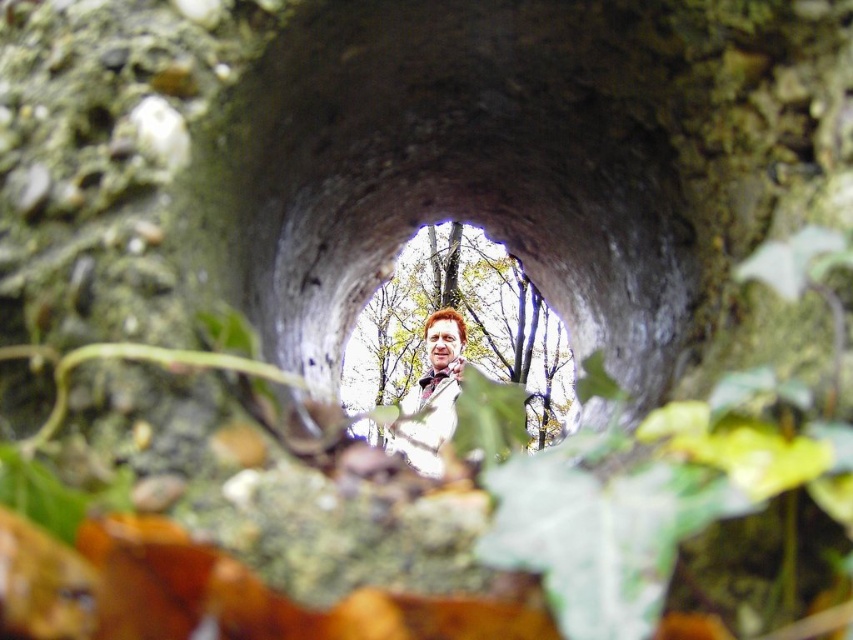
You are a photographer setting up a shot through the smooth concrete hole at center. You want to ensure the light brown leather jacket at center is fully visible. Is the hole wide enough?

The smooth concrete hole at center is thinner than the light brown leather jacket at center, so the hole is not wide enough to fully show the jacket.

You are a photographer standing 40 feet away from a smooth concrete hole at center. Can you move closer to the hole to capture a detailed shot without exceeding the recommended safety distance of 35 feet?

The smooth concrete hole at center is 38.35 feet away from the camera. Since you are currently 40 feet away, you can move 1.65 feet closer to reach the recommended safety distance of 35 feet. However, moving closer than 35 feet would exceed the safety limit.

You are a photographer trying to capture a person through the smooth concrete hole at center. If you want to focus on the light brown leather jacket at center, should you adjust your camera to focus closer or farther away?

The smooth concrete hole at center is further to the viewer than the light brown leather jacket at center, so to focus on the light brown leather jacket at center, you need to adjust the camera to focus farther away.